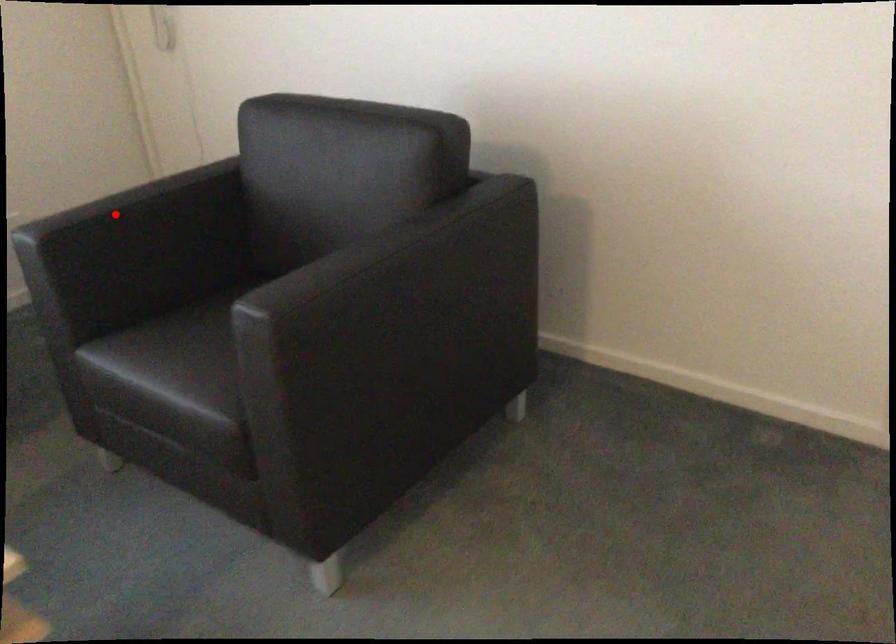
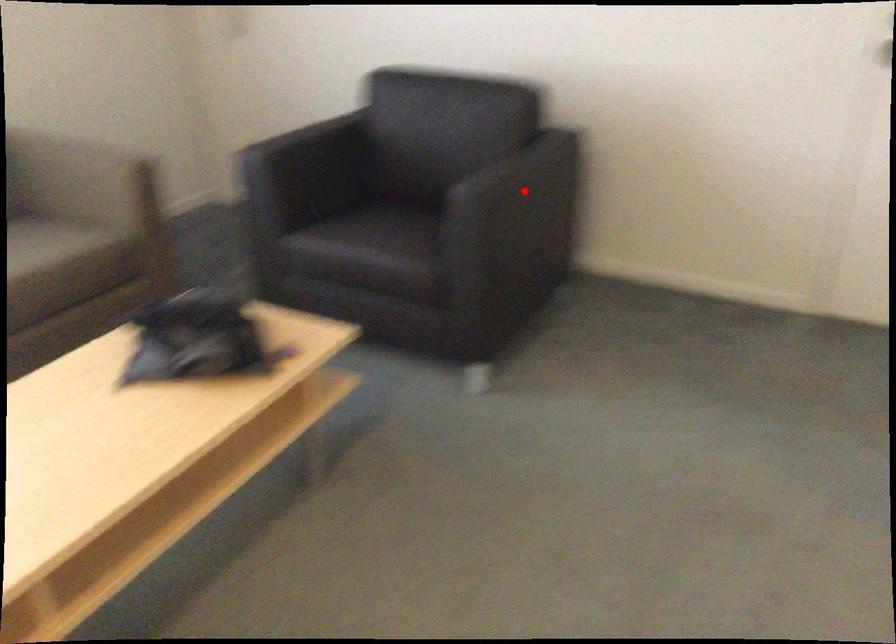
I am providing you with two images of the same scene from different viewpoints. A red point is marked on the first image and another point is marked on the second image. Is the red point in image1 aligned with the point shown in image2?

No